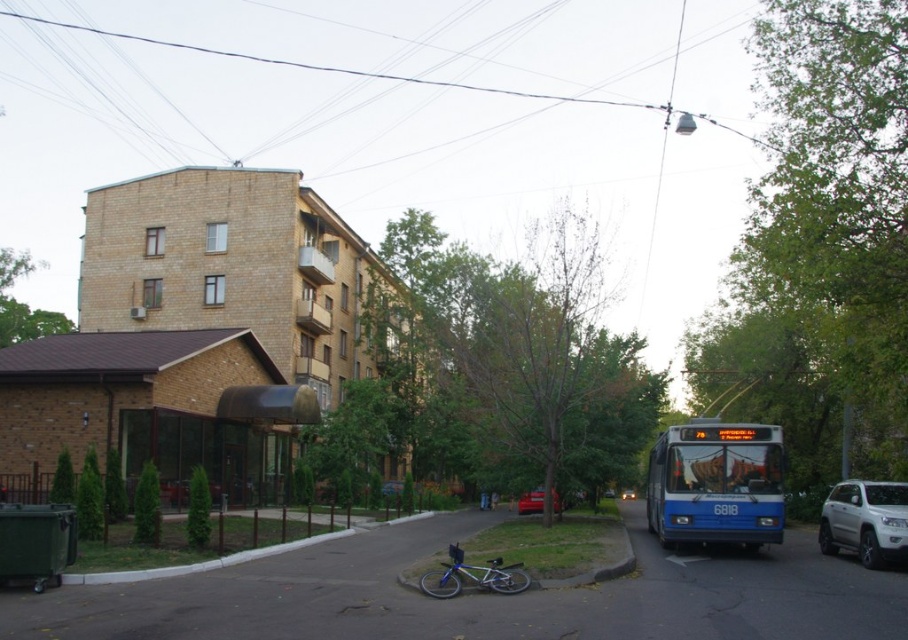
Is point (541, 93) closer to camera compared to point (629, 490)?

No, (541, 93) is further to viewer.

Is black wire at upper center shorter than shiny silver sedan at center?

No.

Between point (510, 90) and point (632, 490), which one is positioned behind?

The point (510, 90) is more distant.

The height and width of the screenshot is (640, 908). Find the location of `black wire at upper center`. black wire at upper center is located at coordinates (378, 72).

Based on the photo, which of these two, blue metallic bus at lower right or white matte suv at lower right, stands taller?

Standing taller between the two is blue metallic bus at lower right.

I want to click on blue metallic bus at lower right, so click(716, 483).

Who is shorter, white concrete curb at lower left or blue metallic bicycle at center?

Standing shorter between the two is blue metallic bicycle at center.

Can you confirm if white concrete curb at lower left is positioned below blue metallic bicycle at center?

Correct, white concrete curb at lower left is located below blue metallic bicycle at center.

Is point (341, 536) positioned before point (492, 589)?

No, (341, 536) is behind (492, 589).

The image size is (908, 640). In order to click on white concrete curb at lower left in this screenshot , I will do `click(198, 563)`.